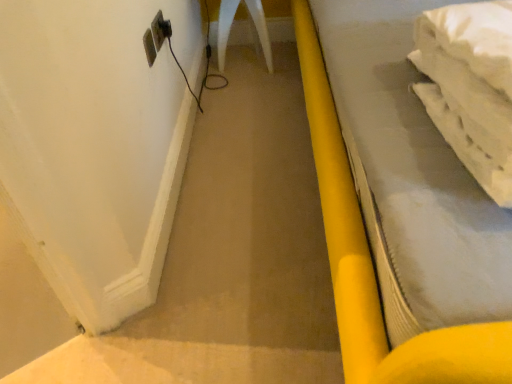
Question: Would you say white plastic electric outlet at upper left is inside or outside black plastic plug at upper left?

Choices:
 (A) outside
 (B) inside

Answer: (A)

Question: From the image's perspective, is white plastic electric outlet at upper left positioned above or below black plastic plug at upper left?

Choices:
 (A) above
 (B) below

Answer: (B)

Question: Estimate the real-world distances between objects in this image. Which object is closer to the white plastic electric outlet at upper left?

Choices:
 (A) black plastic plug at upper left
 (B) yellow plastic bed at right

Answer: (A)

Question: Considering the real-world distances, which object is farthest from the black plastic plug at upper left?

Choices:
 (A) white plastic electric outlet at upper left
 (B) yellow plastic bed at right

Answer: (B)